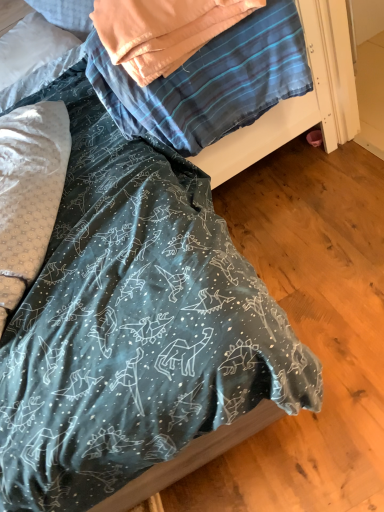
Where is `free region under teal fabric at center (from a real-world perspective)`? This screenshot has width=384, height=512. free region under teal fabric at center (from a real-world perspective) is located at coordinates (269, 184).